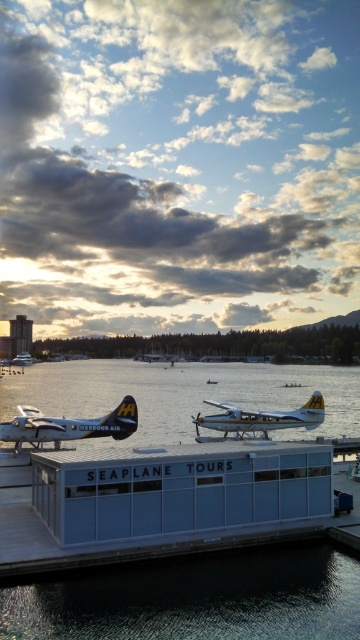
Does clear water at center have a greater width compared to metallic silver seaplane at center?

Yes, clear water at center is wider than metallic silver seaplane at center.

Where is `clear water at center`? clear water at center is located at coordinates (195, 600).

Does clear water at center have a lesser width compared to shiny silver seaplane at lower left?

Yes, clear water at center is thinner than shiny silver seaplane at lower left.

At what (x,y) coordinates should I click in order to perform the action: click on clear water at center. Please return your answer as a coordinate pair (x, y). Looking at the image, I should click on (195, 600).

Locate an element on the screen. This screenshot has height=640, width=360. clear water at center is located at coordinates point(195,600).

Can you confirm if shiny silver seaplane at lower left is taller than matte silver seaplane at center?

Incorrect, shiny silver seaplane at lower left's height is not larger of matte silver seaplane at center's.

Does shiny silver seaplane at lower left come behind matte silver seaplane at center?

Yes, shiny silver seaplane at lower left is behind matte silver seaplane at center.

Image resolution: width=360 pixels, height=640 pixels. What do you see at coordinates (183, 394) in the screenshot?
I see `shiny silver seaplane at lower left` at bounding box center [183, 394].

Image resolution: width=360 pixels, height=640 pixels. Identify the location of shiny silver seaplane at lower left. (183, 394).